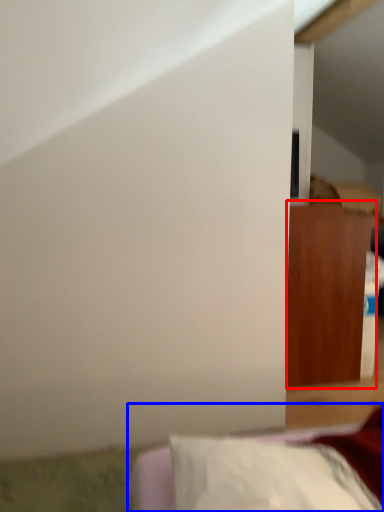
Question: Among these objects, which one is farthest to the camera, furniture (highlighted by a red box) or furniture (highlighted by a blue box)?

Choices:
 (A) furniture
 (B) furniture

Answer: (A)